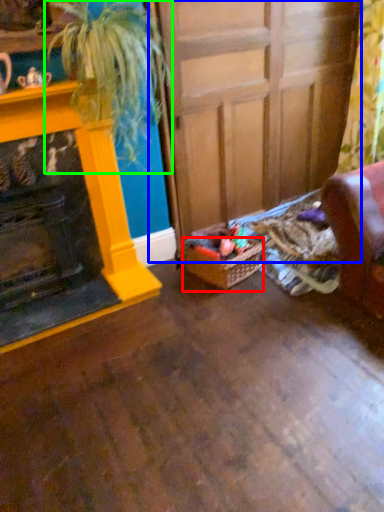
Question: Which is nearer to the basket (highlighted by a red box)? door (highlighted by a blue box) or houseplant (highlighted by a green box).

Choices:
 (A) door
 (B) houseplant

Answer: (A)